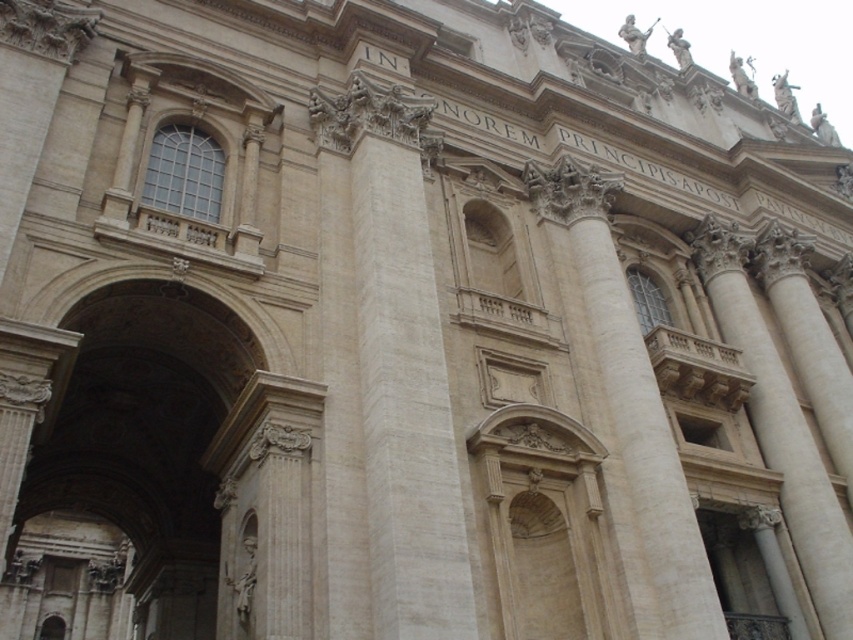
Question: Which object appears closest to the camera in this image?

Choices:
 (A) smooth stone column at right
 (B) white marble column at center
 (C) beige stone column at center

Answer: (B)

Question: Does white marble column at center have a greater width compared to beige stone column at center?

Choices:
 (A) no
 (B) yes

Answer: (B)

Question: Which is farther from the smooth stone column at right?

Choices:
 (A) beige stone column at center
 (B) white marble column at center

Answer: (B)

Question: Considering the relative positions of white marble column at center and beige stone column at center in the image provided, where is white marble column at center located with respect to beige stone column at center?

Choices:
 (A) right
 (B) left

Answer: (B)

Question: Which object appears closest to the camera in this image?

Choices:
 (A) smooth stone column at right
 (B) beige stone column at center

Answer: (B)

Question: Is white marble column at center to the left of smooth stone column at right from the viewer's perspective?

Choices:
 (A) yes
 (B) no

Answer: (A)